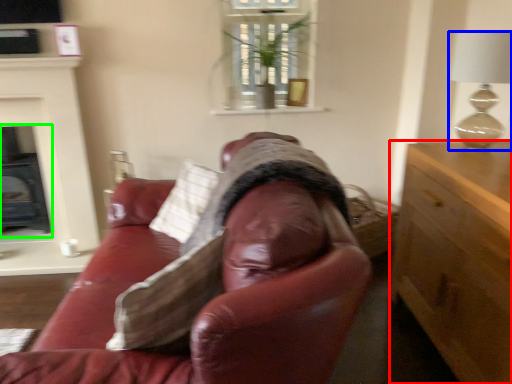
Question: Considering the real-world distances, which object is farthest from cabinetry (highlighted by a red box)? lamp (highlighted by a blue box) or fireplace (highlighted by a green box)?

Choices:
 (A) lamp
 (B) fireplace

Answer: (B)